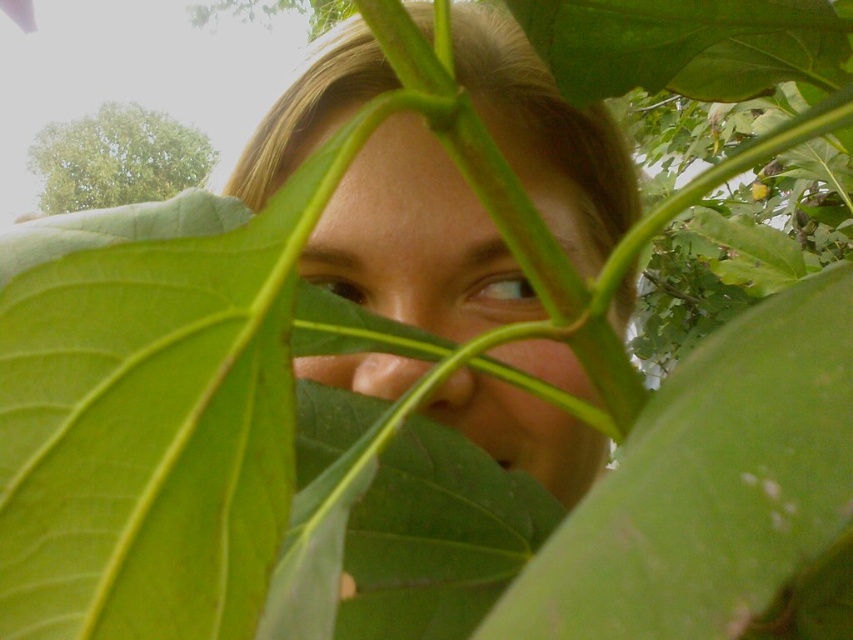
Question: Which object appears farthest from the camera in this image?

Choices:
 (A) green matte leaf at center
 (B) light brown eye at upper center
 (C) brown glossy eye at center

Answer: (C)

Question: Which point is closer to the camera?

Choices:
 (A) light brown eye at upper center
 (B) smooth skin face at center

Answer: (B)

Question: From the image, what is the correct spatial relationship of smooth skin face at center in relation to light brown eye at upper center?

Choices:
 (A) right
 (B) left

Answer: (B)

Question: Based on their relative distances, which object is nearer to the light brown eye at upper center?

Choices:
 (A) green matte leaf at center
 (B) green leafy tree at upper left
 (C) brown glossy eye at center
 (D) green matte leaf at upper center

Answer: (C)

Question: Is green matte leaf at upper center smaller than green leafy tree at upper left?

Choices:
 (A) no
 (B) yes

Answer: (B)

Question: Can you confirm if smooth skin face at center is positioned above light brown eye at upper center?

Choices:
 (A) no
 (B) yes

Answer: (B)